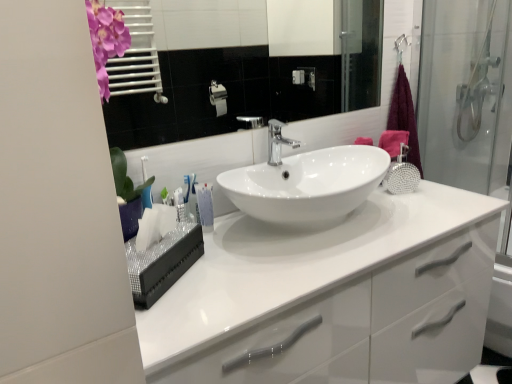
The height and width of the screenshot is (384, 512). Identify the location of vacant area that is situated to the right of white glossy tube at center. pos(251,234).